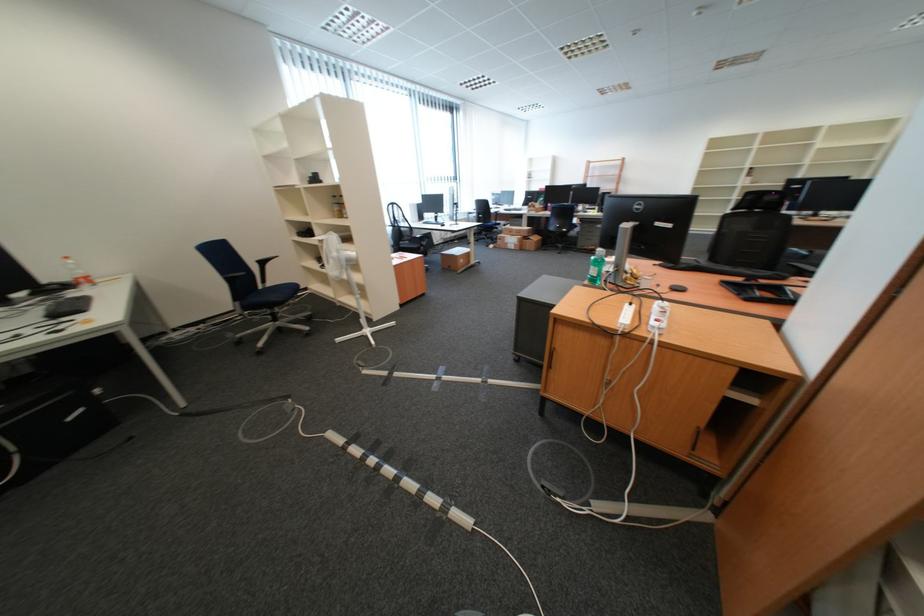
What do you see at coordinates (277, 292) in the screenshot?
I see `the black chair sitting surface` at bounding box center [277, 292].